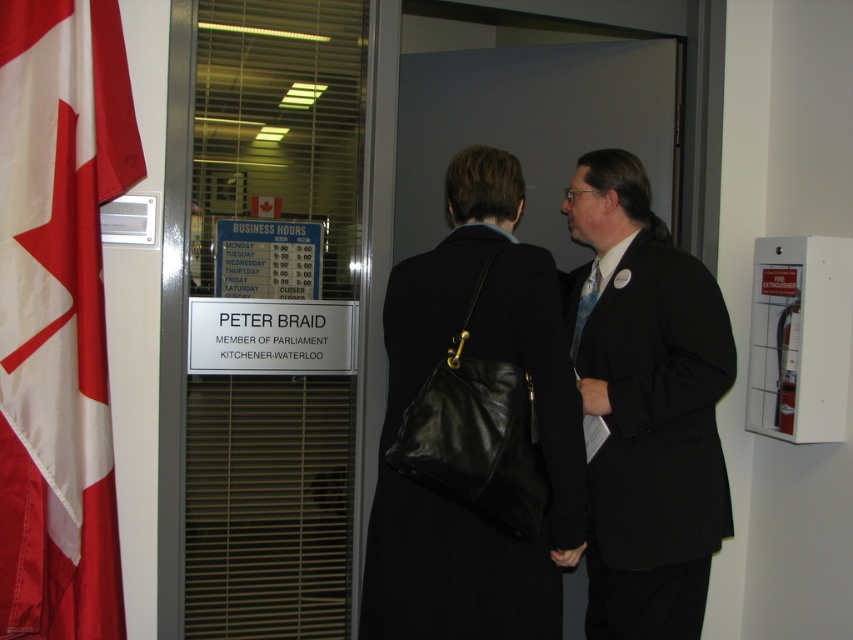
Can you confirm if red cloth flag at left is shorter than matte black coat at center?

No.

Measure the distance between red cloth flag at left and camera.

6.05 feet

The width and height of the screenshot is (853, 640). Identify the location of red cloth flag at left. (57, 314).

Consider the image. Is matte black coat at center bigger than black leather handbag at center?

Correct, matte black coat at center is larger in size than black leather handbag at center.

Measure the distance between matte black coat at center and camera.

matte black coat at center is 1.98 meters from camera.

The height and width of the screenshot is (640, 853). What do you see at coordinates (648, 410) in the screenshot?
I see `matte black coat at center` at bounding box center [648, 410].

Locate an element on the screen. matte black coat at center is located at coordinates pos(648,410).

Does red cloth flag at left have a lesser width compared to blue patterned tie at center?

No, red cloth flag at left is not thinner than blue patterned tie at center.

Can you confirm if red cloth flag at left is positioned below blue patterned tie at center?

Yes, red cloth flag at left is below blue patterned tie at center.

The width and height of the screenshot is (853, 640). In order to click on red cloth flag at left in this screenshot , I will do `click(57, 314)`.